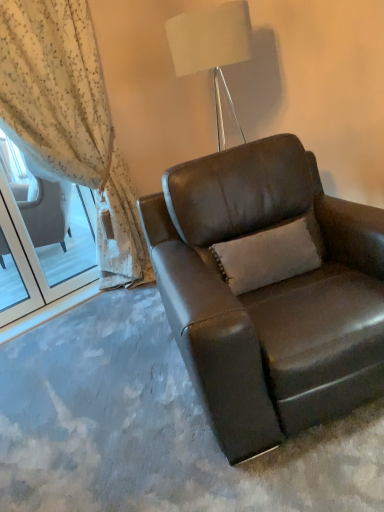
Question: From a real-world perspective, is sheer floral fabric at left located higher than brown leather chair at center?

Choices:
 (A) yes
 (B) no

Answer: (A)

Question: Is sheer floral fabric at left thinner than brown leather chair at center?

Choices:
 (A) yes
 (B) no

Answer: (A)

Question: Is sheer floral fabric at left positioned far away from brown leather chair at center?

Choices:
 (A) yes
 (B) no

Answer: (A)

Question: Does sheer floral fabric at left have a greater width compared to brown leather chair at center?

Choices:
 (A) yes
 (B) no

Answer: (B)

Question: Is sheer floral fabric at left to the right of brown leather chair at center from the viewer's perspective?

Choices:
 (A) yes
 (B) no

Answer: (B)

Question: Does sheer floral fabric at left have a greater height compared to brown leather chair at center?

Choices:
 (A) no
 (B) yes

Answer: (B)

Question: Would you say sheer floral fabric at left is a long distance from white fabric lampshade at upper center?

Choices:
 (A) yes
 (B) no

Answer: (B)

Question: From a real-world perspective, is sheer floral fabric at left positioned under white fabric lampshade at upper center based on gravity?

Choices:
 (A) no
 (B) yes

Answer: (B)

Question: Is sheer floral fabric at left facing away from white fabric lampshade at upper center?

Choices:
 (A) no
 (B) yes

Answer: (A)

Question: From the image's perspective, would you say sheer floral fabric at left is shown under white fabric lampshade at upper center?

Choices:
 (A) no
 (B) yes

Answer: (B)

Question: Is sheer floral fabric at left outside of white fabric lampshade at upper center?

Choices:
 (A) yes
 (B) no

Answer: (A)

Question: Is sheer floral fabric at left at the right side of white fabric lampshade at upper center?

Choices:
 (A) no
 (B) yes

Answer: (A)

Question: Does brown leather chair at center have a lesser width compared to white fabric lampshade at upper center?

Choices:
 (A) yes
 (B) no

Answer: (B)